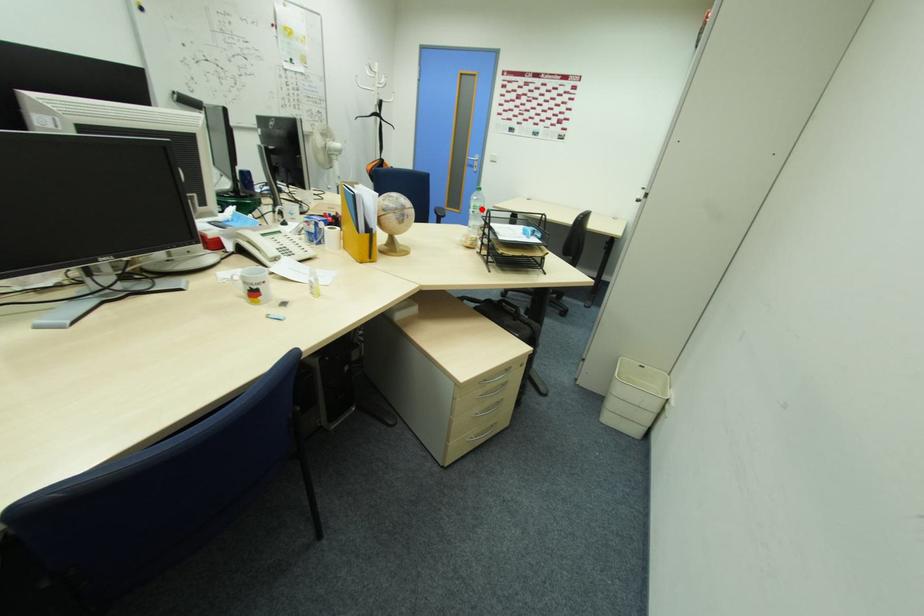
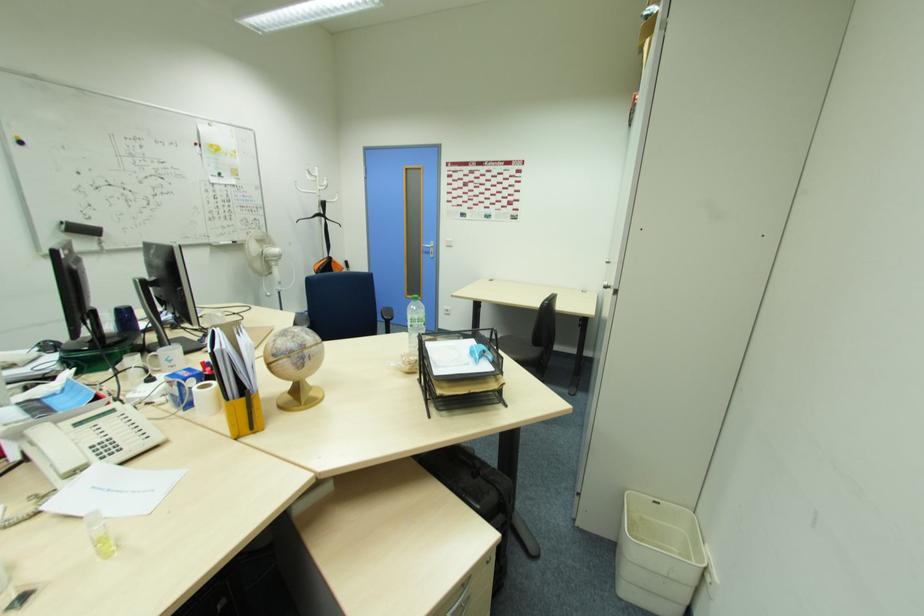
Question: I am providing you with two images of the same scene from different viewpoints. Image1 has a red point marked. In image2, the corresponding 3D location appears at what relative position? Reply with the corresponding letter.

Choices:
 (A) Closer
 (B) Farther

Answer: (B)